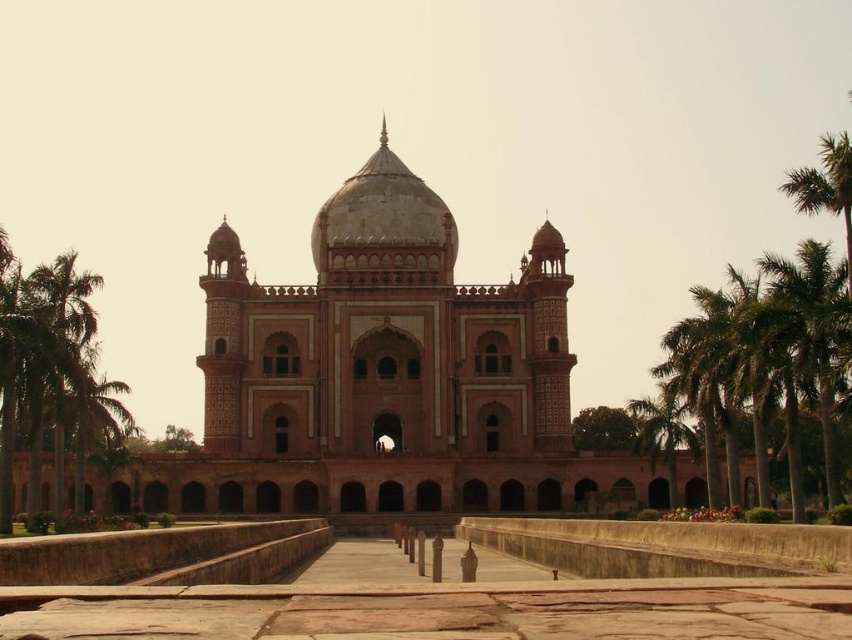
Question: Which point appears closest to the camera in this image?

Choices:
 (A) (42, 268)
 (B) (530, 259)
 (C) (658, 419)

Answer: (A)

Question: Which point is farther to the camera?

Choices:
 (A) green leafy palm tree at left
 (B) pink stone palace at center

Answer: (B)

Question: Does green leafy palm tree at left have a greater width compared to green leafy palm tree at right?

Choices:
 (A) no
 (B) yes

Answer: (B)

Question: Which point appears farthest from the camera in this image?

Choices:
 (A) (4, 372)
 (B) (125, 499)

Answer: (B)

Question: Does pink stone palace at center have a larger size compared to green leafy palm tree at left?

Choices:
 (A) yes
 (B) no

Answer: (A)

Question: Considering the relative positions of pink stone palace at center and green leafy palm tree at right in the image provided, where is pink stone palace at center located with respect to green leafy palm tree at right?

Choices:
 (A) above
 (B) below

Answer: (A)